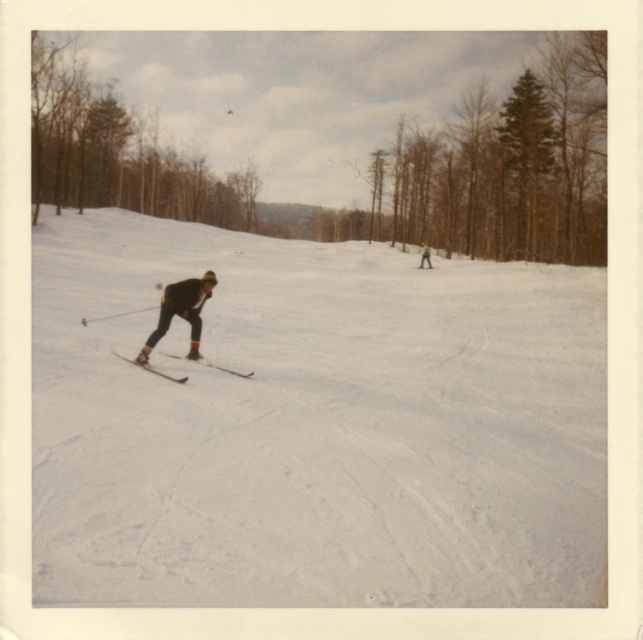
You are a skier planning to jump over the matte black ski at center. Based on the scene, can you determine if the white matte snow at center will provide enough height for your jump?

The white matte snow at center has a greater height compared to the matte black ski at center, so yes, the snow provides sufficient height for the jump.

You are a photographer trying to capture both the brown textured tree at upper right and the metallic silver skis at center in a single shot. Which object should you focus on first to ensure both are in frame?

You should focus on the brown textured tree at upper right first because it is larger than the metallic silver skis at center, ensuring it fits within the frame while adjusting for the smaller skis.